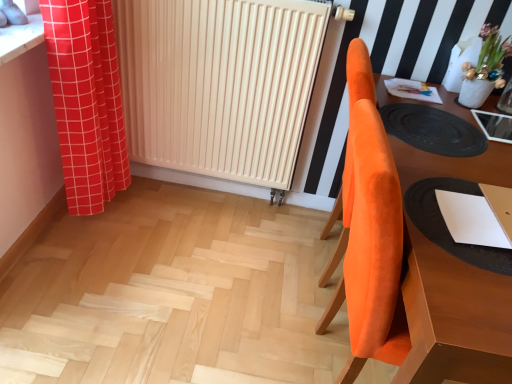
This screenshot has height=384, width=512. I want to click on red checkered curtain at left, so coord(86,101).

In order to face red checkered curtain at left, should I rotate leftwards or rightwards?

Turn left by 20.861 degrees to look at red checkered curtain at left.

At what (x,y) coordinates should I click in order to perform the action: click on white paper at right. Please return your answer as a coordinate pair (x, y). The width and height of the screenshot is (512, 384). Looking at the image, I should click on (470, 220).

The width and height of the screenshot is (512, 384). What do you see at coordinates (470, 220) in the screenshot?
I see `white paper at right` at bounding box center [470, 220].

This screenshot has height=384, width=512. What do you see at coordinates (219, 84) in the screenshot? I see `white matte radiator at center` at bounding box center [219, 84].

The width and height of the screenshot is (512, 384). What do you see at coordinates (173, 297) in the screenshot?
I see `natural wood stairs at center` at bounding box center [173, 297].

The image size is (512, 384). What are the coordinates of `red checkered curtain at left` in the screenshot? It's located at (86, 101).

Is natural wood stairs at center thinner than white matte radiator at center?

In fact, natural wood stairs at center might be wider than white matte radiator at center.

Would you say natural wood stairs at center is a long distance from white matte radiator at center?

They are positioned close to each other.

Considering the relative sizes of natural wood stairs at center and white matte radiator at center in the image provided, is natural wood stairs at center smaller than white matte radiator at center?

Indeed, natural wood stairs at center has a smaller size compared to white matte radiator at center.

Does red checkered curtain at left appear on the left side of white paper at right?

Correct, you'll find red checkered curtain at left to the left of white paper at right.

Does red checkered curtain at left have a greater height compared to white paper at right?

Yes.

Locate an element on the screen. This screenshot has height=384, width=512. curtain above the white paper at right (from the image's perspective) is located at coordinates (86, 101).

Can you tell me how much red checkered curtain at left and white paper at right differ in facing direction?

red checkered curtain at left and white paper at right are facing 1.84 degrees away from each other.

Locate an element on the screen. The height and width of the screenshot is (384, 512). stairs below the red checkered curtain at left (from the image's perspective) is located at coordinates (173, 297).

Between natural wood stairs at center and red checkered curtain at left, which one has less height?

natural wood stairs at center.

Is red checkered curtain at left at the back of natural wood stairs at center?

No, natural wood stairs at center's orientation is not away from red checkered curtain at left.

Based on the photo, in the image, is natural wood stairs at center positioned in front of or behind red checkered curtain at left?

In the image, natural wood stairs at center appears in front of red checkered curtain at left.

Is white matte radiator at center at the back of orange velvet chair at right?

No, white matte radiator at center is not at the back of orange velvet chair at right.

Consider the image. Does orange velvet chair at right lie behind white matte radiator at center?

No, orange velvet chair at right is in front of white matte radiator at center.

Is orange velvet chair at right outside of white matte radiator at center?

Yes, orange velvet chair at right is located beyond the bounds of white matte radiator at center.

Between orange velvet chair at right and white matte radiator at center, which one appears on the right side from the viewer's perspective?

From the viewer's perspective, orange velvet chair at right appears more on the right side.

Looking at this image, is red checkered curtain at left not inside orange velvet chair at right?

Yes, red checkered curtain at left is outside of orange velvet chair at right.

What's the angular difference between red checkered curtain at left and orange velvet chair at right's facing directions?

The facing directions of red checkered curtain at left and orange velvet chair at right are 91.6 degrees apart.

Is red checkered curtain at left closer to camera compared to orange velvet chair at right?

No, red checkered curtain at left is further to the viewer.

Does red checkered curtain at left have a greater width compared to orange velvet chair at right?

Incorrect, the width of red checkered curtain at left does not surpass that of orange velvet chair at right.

Considering the positions of objects white paper at right and black rubber mat at right in the image provided, who is in front, white paper at right or black rubber mat at right?

Positioned in front is white paper at right.

Can you confirm if white paper at right is thinner than black rubber mat at right?

Yes, white paper at right is thinner than black rubber mat at right.

Is the surface of white paper at right in direct contact with black rubber mat at right?

No, white paper at right is not beside black rubber mat at right.

How different are the orientations of white paper at right and black rubber mat at right in degrees?

white paper at right and black rubber mat at right are facing 177 degrees away from each other.

Looking at this image, is white paper at right further to camera compared to natural wood stairs at center?

No.

Visually, is white paper at right positioned to the left or to the right of natural wood stairs at center?

white paper at right is positioned on natural wood stairs at center's right side.

Identify the location of stairs located on the left of white paper at right. (173, 297).

What are the coordinates of `stairs on the left of white matte radiator at center` in the screenshot? It's located at (173, 297).

Identify the location of curtain behind the white paper at right. (86, 101).

When comparing their distances from natural wood stairs at center, does white matte radiator at center or black rubber mat at right seem closer?

white matte radiator at center is positioned closer to the anchor natural wood stairs at center.

When comparing their distances from red checkered curtain at left, does natural wood stairs at center or white matte radiator at center seem closer?

Based on the image, white matte radiator at center appears to be nearer to red checkered curtain at left.

Considering their positions, is white matte radiator at center positioned further to orange velvet chair at right than red checkered curtain at left?

Based on the image, red checkered curtain at left appears to be further to orange velvet chair at right.

Based on their spatial positions, is red checkered curtain at left or white paper at right further from natural wood stairs at center?

The object further to natural wood stairs at center is white paper at right.

Considering their positions, is natural wood stairs at center positioned closer to orange velvet chair at right than white matte radiator at center?

natural wood stairs at center.

Which object lies nearer to the anchor point orange velvet chair at right, white paper at right or black rubber mat at right?

Based on the image, white paper at right appears to be nearer to orange velvet chair at right.

From the image, which object appears to be nearer to white paper at right, black rubber mat at right or red checkered curtain at left?

black rubber mat at right.

Estimate the real-world distances between objects in this image. Which object is closer to orange velvet chair at right, natural wood stairs at center or red checkered curtain at left?

natural wood stairs at center.

Identify the location of notepad between red checkered curtain at left and black rubber mat at right. The image size is (512, 384). (470, 220).

I want to click on radiator between natural wood stairs at center and black rubber mat at right from left to right, so click(x=219, y=84).

You are a GUI agent. You are given a task and a screenshot of the screen. Output one action in this format:
    pyautogui.click(x=<x>, y=<y>)
    Task: Click on the mat situated between red checkered curtain at left and orange velvet chair at right from left to right
    The image size is (512, 384).
    Given the screenshot: What is the action you would take?
    pyautogui.click(x=433, y=130)

Where is `radiator between red checkered curtain at left and orange velvet chair at right from left to right`? radiator between red checkered curtain at left and orange velvet chair at right from left to right is located at coordinates (219, 84).